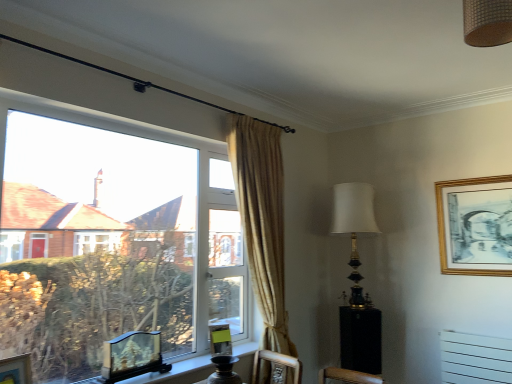
Measure the distance between gold/gilded picture frame at upper right, which is counted as the fourth picture frame, starting from the left, and camera.

gold/gilded picture frame at upper right, which is counted as the fourth picture frame, starting from the left, and camera are 9.98 feet apart from each other.

I want to click on gold metallic table lamp at upper right, so click(x=354, y=227).

At what (x,y) coordinates should I click in order to perform the action: click on clear glass window at left. Please return your answer as a coordinate pair (x, y). Looking at the image, I should click on (117, 239).

What is the approximate height of black glossy side table at lower right?

22.99 inches.

Where is `gold/gilded picture frame at upper right, which is the first picture frame in back-to-front order`? The height and width of the screenshot is (384, 512). gold/gilded picture frame at upper right, which is the first picture frame in back-to-front order is located at coordinates (475, 226).

In terms of height, does gold metallic table lamp at upper right look taller or shorter compared to wooden picture frame at lower left, which is counted as the second picture frame, starting from the top?

In the image, gold metallic table lamp at upper right appears to be taller than wooden picture frame at lower left, which is counted as the second picture frame, starting from the top.

From a real-world perspective, which object rests below the other?

From a 3D spatial view, wooden picture frame at lower left, the first picture frame viewed from the front, is below.

Considering the sizes of objects wooden picture frame at lower left, the third picture frame ordered from the bottom, and clear glass window at left in the image provided, who is shorter, wooden picture frame at lower left, the third picture frame ordered from the bottom, or clear glass window at left?

wooden picture frame at lower left, the third picture frame ordered from the bottom, is shorter.

Is wooden picture frame at lower left, the third picture frame ordered from the bottom, facing away from clear glass window at left?

Yes, wooden picture frame at lower left, the third picture frame ordered from the bottom, is facing away from clear glass window at left.

Looking at this image, how many degrees apart are the facing directions of wooden picture frame at lower left, positioned as the 4th picture frame in right-to-left order, and clear glass window at left?

The angle between the facing direction of wooden picture frame at lower left, positioned as the 4th picture frame in right-to-left order, and the facing direction of clear glass window at left is 10.8 degrees.

How far apart are wooden picture frame at lower left, the first picture frame viewed from the front, and brown woven lampshade at upper right?

The distance of wooden picture frame at lower left, the first picture frame viewed from the front, from brown woven lampshade at upper right is 7.69 feet.

Who is smaller, wooden picture frame at lower left, the 1th picture frame in the left-to-right sequence, or brown woven lampshade at upper right?

wooden picture frame at lower left, the 1th picture frame in the left-to-right sequence.

Consider the image. Is wooden picture frame at lower left, which is counted as the second picture frame, starting from the top, completely or partially outside of brown woven lampshade at upper right?

Yes, wooden picture frame at lower left, which is counted as the second picture frame, starting from the top, is not within brown woven lampshade at upper right.

From the image's perspective, which object appears higher, wooden picture frame at lower left, positioned as the 4th picture frame in right-to-left order, or brown woven lampshade at upper right?

brown woven lampshade at upper right, from the image's perspective.

In the image, is clear glass window at left on the left side or the right side of gold/gilded picture frame at upper right, which is the first picture frame in back-to-front order?

Based on their positions, clear glass window at left is located to the left of gold/gilded picture frame at upper right, which is the first picture frame in back-to-front order.

From a real-world perspective, is clear glass window at left physically located above or below gold/gilded picture frame at upper right, which is counted as the fourth picture frame, starting from the left?

clear glass window at left is below gold/gilded picture frame at upper right, which is counted as the fourth picture frame, starting from the left.

Is clear glass window at left far from gold/gilded picture frame at upper right, which is counted as the fourth picture frame, starting from the left?

Yes.

From a real-world perspective, who is located lower, clear glass window at left or wooden picture frame at lower left, positioned as the 4th picture frame in right-to-left order?

wooden picture frame at lower left, positioned as the 4th picture frame in right-to-left order, from a real-world perspective.

Is clear glass window at left not inside wooden picture frame at lower left, the first picture frame viewed from the front?

Absolutely, clear glass window at left is external to wooden picture frame at lower left, the first picture frame viewed from the front.

At what (x,y) coordinates should I click in order to perform the action: click on window above the wooden picture frame at lower left, the first picture frame viewed from the front (from the image's perspective). Please return your answer as a coordinate pair (x, y). Image resolution: width=512 pixels, height=384 pixels. Looking at the image, I should click on (117, 239).

Is the depth of clear glass window at left less than that of wooden picture frame at lower left, the 1th picture frame in the left-to-right sequence?

No, clear glass window at left is behind wooden picture frame at lower left, the 1th picture frame in the left-to-right sequence.

Considering the sizes of brown woven lampshade at upper right and wooden picture frame at lower left, positioned as the 4th picture frame in right-to-left order, in the image, is brown woven lampshade at upper right taller or shorter than wooden picture frame at lower left, positioned as the 4th picture frame in right-to-left order,?

Considering their sizes, brown woven lampshade at upper right has less height than wooden picture frame at lower left, positioned as the 4th picture frame in right-to-left order.

At what (x,y) coordinates should I click in order to perform the action: click on lamp above the wooden picture frame at lower left, the first picture frame viewed from the front (from a real-world perspective). Please return your answer as a coordinate pair (x, y). Image resolution: width=512 pixels, height=384 pixels. Looking at the image, I should click on tap(487, 22).

Is brown woven lampshade at upper right thinner than wooden picture frame at lower left, the third picture frame ordered from the bottom?

Incorrect, the width of brown woven lampshade at upper right is not less than that of wooden picture frame at lower left, the third picture frame ordered from the bottom.

Is matte green picture frame at lower center, the first picture frame from the bottom, turned away from gold metallic table lamp at upper right?

That's not correct — matte green picture frame at lower center, the first picture frame from the bottom, is not looking away from gold metallic table lamp at upper right.

Choose the correct answer: Is matte green picture frame at lower center, which is counted as the third picture frame, starting from the left, inside gold metallic table lamp at upper right or outside it?

matte green picture frame at lower center, which is counted as the third picture frame, starting from the left, cannot be found inside gold metallic table lamp at upper right.

Does matte green picture frame at lower center, which is counted as the third picture frame, starting from the left, have a smaller size compared to gold metallic table lamp at upper right?

Indeed, matte green picture frame at lower center, which is counted as the third picture frame, starting from the left, has a smaller size compared to gold metallic table lamp at upper right.

From the image's perspective, is matte green picture frame at lower center, marked as the 2th picture frame in a right-to-left arrangement, located above gold metallic table lamp at upper right?

Incorrect, from the image's perspective, matte green picture frame at lower center, marked as the 2th picture frame in a right-to-left arrangement, is lower than gold metallic table lamp at upper right.

Find the location of a particular element. The height and width of the screenshot is (384, 512). table lamp lying behind the wooden picture frame at lower left, positioned as the 4th picture frame in right-to-left order is located at coordinates (354, 227).

In order to click on picture frame in front of the clear glass window at left in this screenshot , I will do `click(16, 370)`.

Looking at the image, which one is located closer to wooden picture frame at lower left, the first picture frame viewed from the front, clear glass window at left or wooden carved picture frame at window, the 2th picture frame in the left-to-right sequence?

wooden carved picture frame at window, the 2th picture frame in the left-to-right sequence, is closer to wooden picture frame at lower left, the first picture frame viewed from the front.

Looking at the image, which one is located further to gold/gilded picture frame at upper right, the 1th picture frame when ordered from right to left, clear glass window at left or black glossy side table at lower right?

clear glass window at left.

Looking at the image, which one is located further to wooden carved picture frame at window, the 2th picture frame from the bottom, gold metallic table lamp at upper right or wooden picture frame at lower left, arranged as the 4th picture frame when viewed from the back?

Based on the image, gold metallic table lamp at upper right appears to be further to wooden carved picture frame at window, the 2th picture frame from the bottom.

When comparing their distances from brown woven lampshade at upper right, does gold metallic table lamp at upper right or wooden picture frame at lower left, the 1th picture frame in the left-to-right sequence, seem closer?

gold metallic table lamp at upper right.

Based on their spatial positions, is brown woven lampshade at upper right or wooden picture frame at lower left, the 1th picture frame in the left-to-right sequence, closer to clear glass window at left?

wooden picture frame at lower left, the 1th picture frame in the left-to-right sequence, is positioned closer to the anchor clear glass window at left.

From the image, which object appears to be farther from wooden carved picture frame at window, the 2th picture frame in the left-to-right sequence, brown woven lampshade at upper right or gold metallic table lamp at upper right?

The object further to wooden carved picture frame at window, the 2th picture frame in the left-to-right sequence, is brown woven lampshade at upper right.

From the image, which object appears to be nearer to wooden carved picture frame at window, the 2th picture frame from the bottom, clear glass window at left or black glossy side table at lower right?

The object closer to wooden carved picture frame at window, the 2th picture frame from the bottom, is clear glass window at left.

When comparing their distances from wooden carved picture frame at window, which is counted as the third picture frame, starting from the right, does brown woven lampshade at upper right or wooden picture frame at lower left, the third picture frame ordered from the bottom, seem closer?

wooden picture frame at lower left, the third picture frame ordered from the bottom, lies closer to wooden carved picture frame at window, which is counted as the third picture frame, starting from the right, than the other object.

Locate an element on the screen. This screenshot has height=384, width=512. lamp between wooden picture frame at lower left, arranged as the 4th picture frame when viewed from the back, and gold metallic table lamp at upper right, in the horizontal direction is located at coordinates (487, 22).

Locate an element on the screen. The width and height of the screenshot is (512, 384). picture frame situated between wooden carved picture frame at window, the third picture frame in the top-to-bottom sequence, and gold/gilded picture frame at upper right, the 4th picture frame when ordered from bottom to top, from left to right is located at coordinates (220, 340).

Identify the location of picture frame between clear glass window at left and black glossy side table at lower right in the horizontal direction. (220, 340).

Locate an element on the screen. Image resolution: width=512 pixels, height=384 pixels. window located between brown woven lampshade at upper right and gold metallic table lamp at upper right in the depth direction is located at coordinates (117, 239).